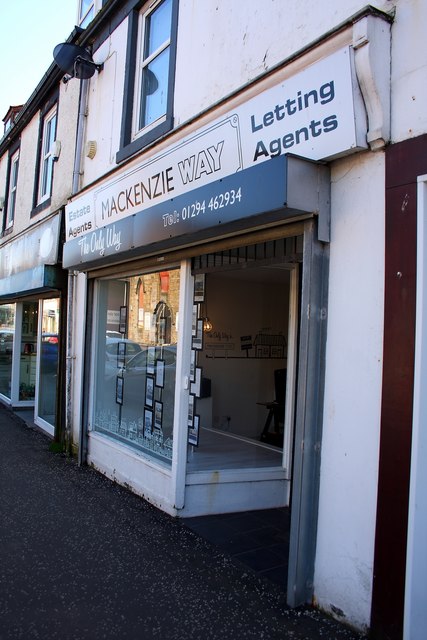
Where is `window frame`? The height and width of the screenshot is (640, 427). window frame is located at coordinates (133, 134).